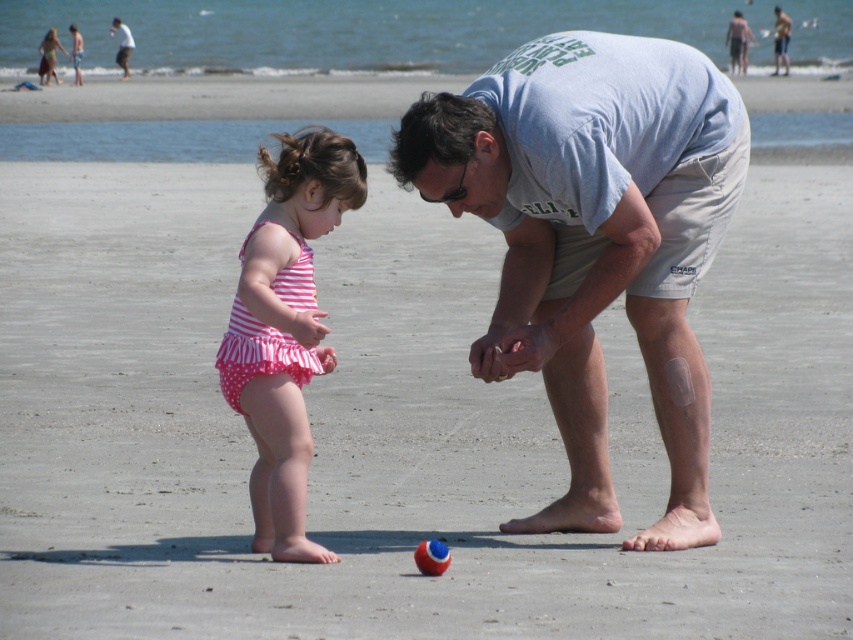
Does pink polka dot swimsuit at left appear on the left side of white cotton shirt at upper left?

Incorrect, pink polka dot swimsuit at left is not on the left side of white cotton shirt at upper left.

Identify the location of pink polka dot swimsuit at left. Image resolution: width=853 pixels, height=640 pixels. (285, 328).

Is gray cotton shirt at center taller than white cotton shirt at upper left?

No.

Locate an element on the screen. Image resolution: width=853 pixels, height=640 pixels. gray cotton shirt at center is located at coordinates (593, 241).

This screenshot has height=640, width=853. What do you see at coordinates (431, 556) in the screenshot?
I see `red glossy beach ball at center` at bounding box center [431, 556].

Is red glossy beach ball at center positioned at the back of light blue t-shirt at center?

That is False.

Identify the location of red glossy beach ball at center. (431, 556).